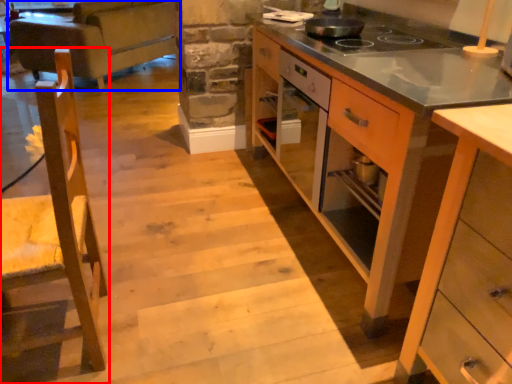
Question: Which object is closer to the camera taking this photo, chair (highlighted by a red box) or studio couch (highlighted by a blue box)?

Choices:
 (A) chair
 (B) studio couch

Answer: (A)